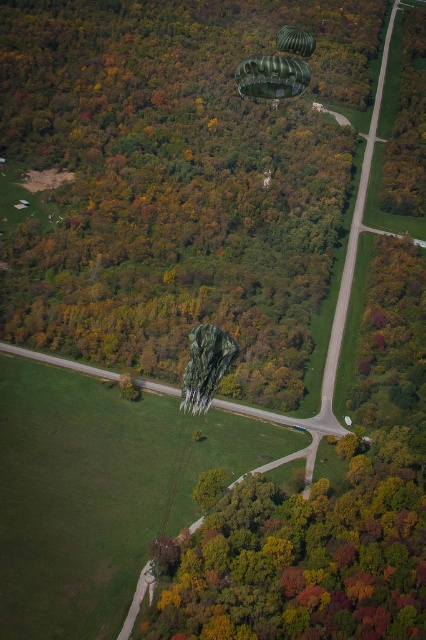
In the scene shown: Is green matte balloon at upper center to the left of green fabric parachute at upper center from the viewer's perspective?

Indeed, green matte balloon at upper center is positioned on the left side of green fabric parachute at upper center.

Is the position of green matte balloon at upper center less distant than that of green fabric parachute at upper center?

Yes, green matte balloon at upper center is in front of green fabric parachute at upper center.

Which is behind, point (291, 84) or point (290, 36)?

Positioned behind is point (290, 36).

Find the location of a particular element. The image size is (426, 640). green matte balloon at upper center is located at coordinates (271, 76).

Does green matte parachute at center appear on the right side of green matte balloon at upper center?

No, green matte parachute at center is not to the right of green matte balloon at upper center.

Can you confirm if green matte parachute at center is positioned to the left of green matte balloon at upper center?

Correct, you'll find green matte parachute at center to the left of green matte balloon at upper center.

Describe the element at coordinates (204, 365) in the screenshot. I see `green matte parachute at center` at that location.

Find the location of a particular element. The image size is (426, 640). green matte parachute at center is located at coordinates (204, 365).

Consider the image. Which is below, green matte parachute at center or green fabric parachute at upper center?

green matte parachute at center is lower down.

Looking at this image, which of these two, green matte parachute at center or green fabric parachute at upper center, stands shorter?

With less height is green matte parachute at center.

Describe the element at coordinates (204, 365) in the screenshot. I see `green matte parachute at center` at that location.

The width and height of the screenshot is (426, 640). Find the location of `green matte parachute at center`. green matte parachute at center is located at coordinates (204, 365).